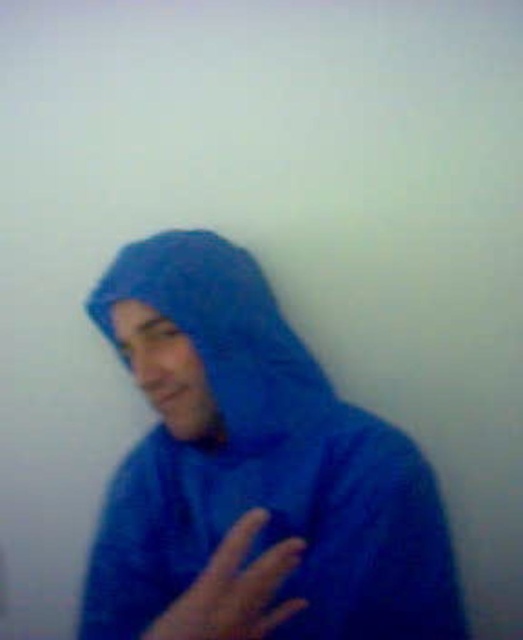
Question: Is blue fabric hoodie at center to the left of blue fabric hand at center from the viewer's perspective?

Choices:
 (A) yes
 (B) no

Answer: (A)

Question: Which point is farther from the camera taking this photo?

Choices:
 (A) (407, 600)
 (B) (230, 598)
 (C) (203, 300)

Answer: (C)

Question: Does blue fabric hoodie at center appear over blue fabric hand at center?

Choices:
 (A) no
 (B) yes

Answer: (B)

Question: Based on their relative distances, which object is farther from the blue fabric hoodie at center?

Choices:
 (A) blue fabric hood at center
 (B) blue fabric hand at center

Answer: (B)

Question: Which object is the closest to the blue fabric hand at center?

Choices:
 (A) blue fabric hoodie at center
 (B) blue fabric hood at center

Answer: (A)

Question: Does blue fabric hood at center have a lesser width compared to blue fabric hand at center?

Choices:
 (A) no
 (B) yes

Answer: (A)